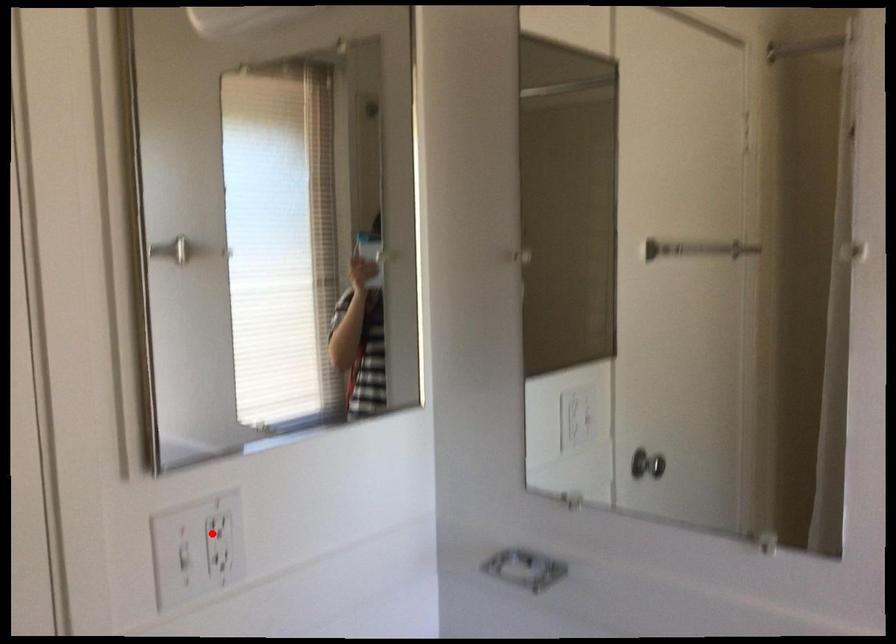
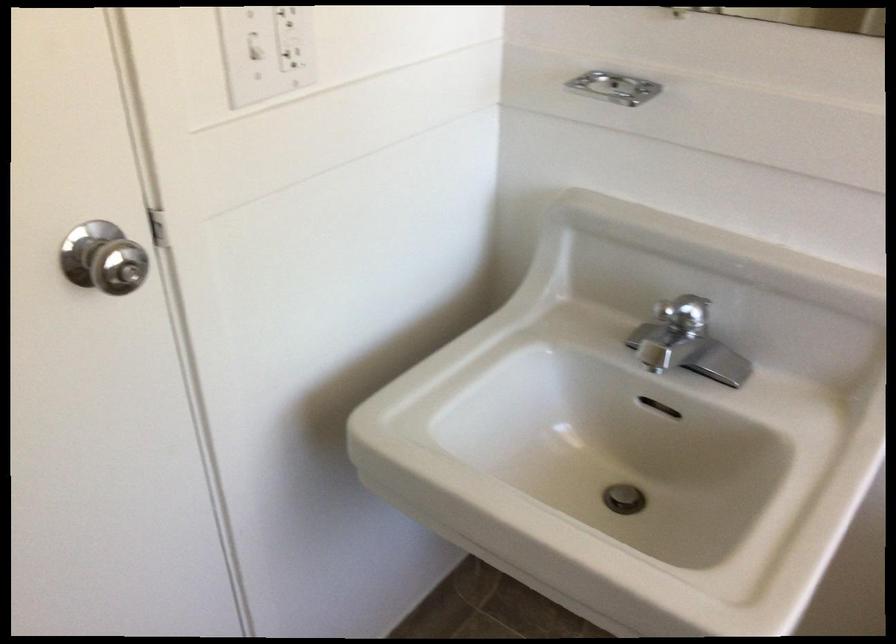
The point at the highlighted location is marked in the first image. Where is the corresponding point in the second image?

(287, 15)